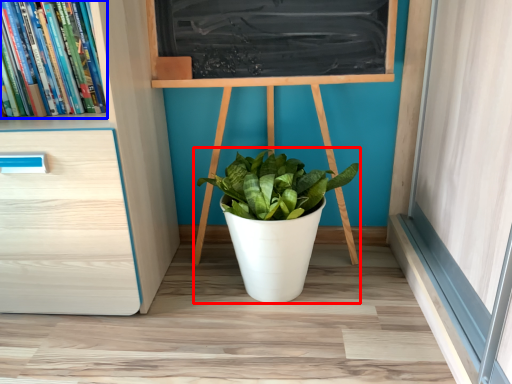
Question: Among these objects, which one is nearest to the camera, houseplant (highlighted by a red box) or book (highlighted by a blue box)?

Choices:
 (A) houseplant
 (B) book

Answer: (B)